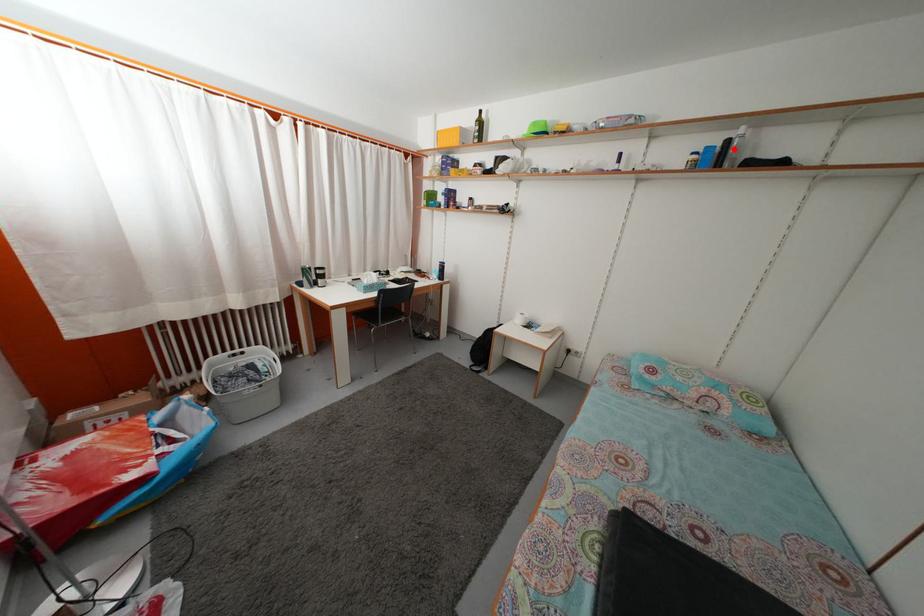
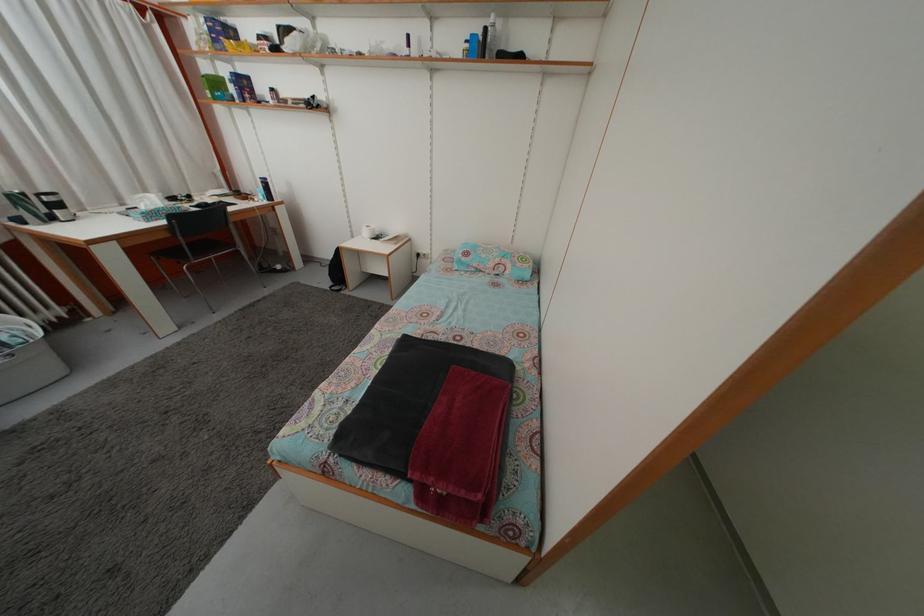
Locate, in the second image, the point that corresponds to the highlighted location in the first image.

(492, 38)